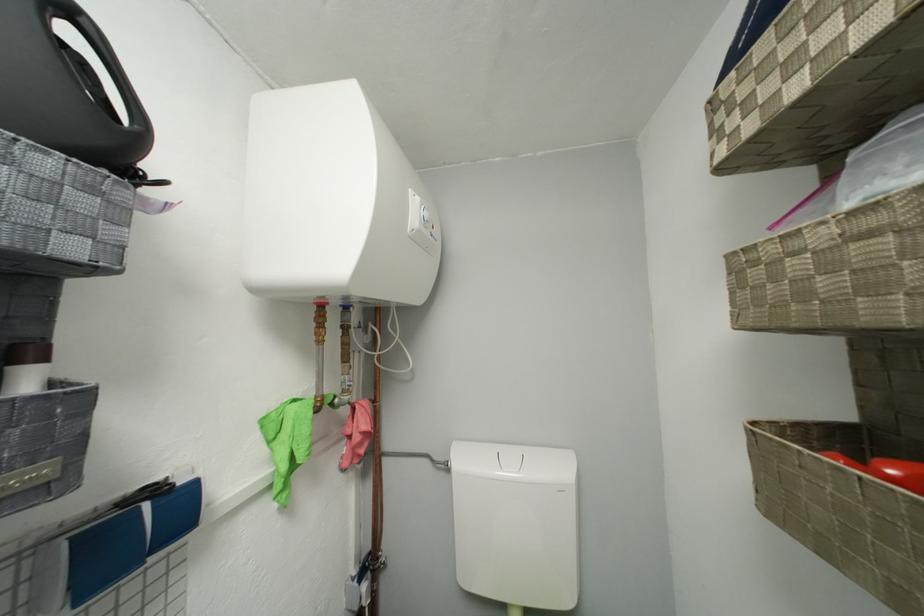
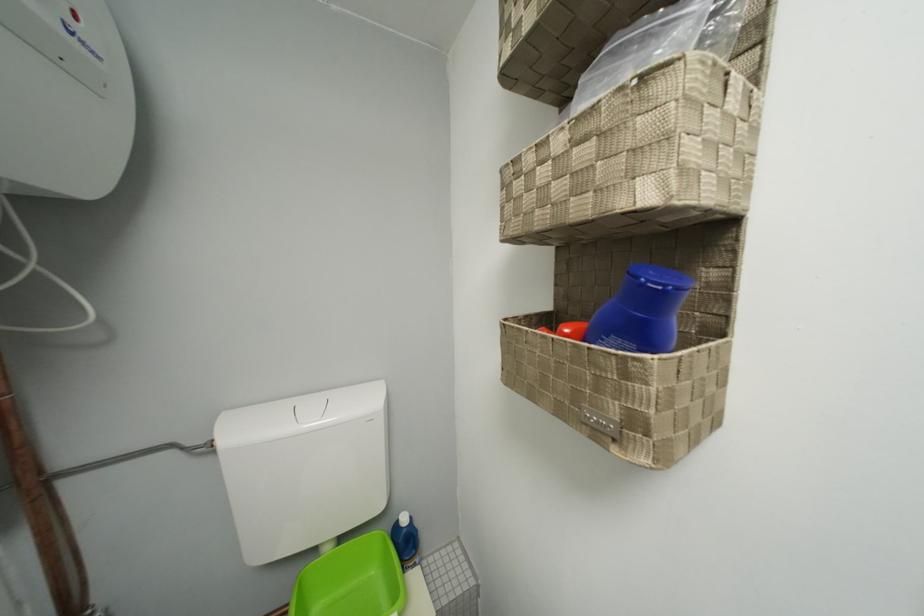
Question: The images are taken continuously from a first-person perspective. In which direction is your viewpoint rotating?

Choices:
 (A) Left
 (B) Right
 (C) Up
 (D) Down

Answer: (B)